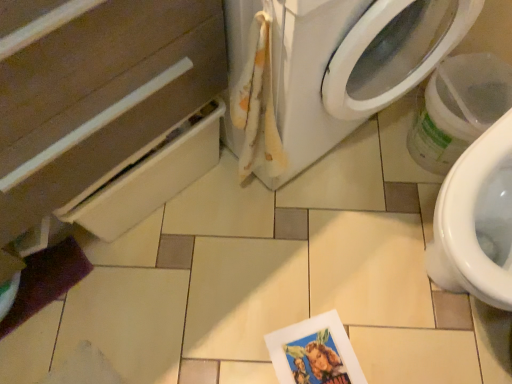
Find the location of a particular element. free point behind printed paper postcard at lower center is located at coordinates (324, 279).